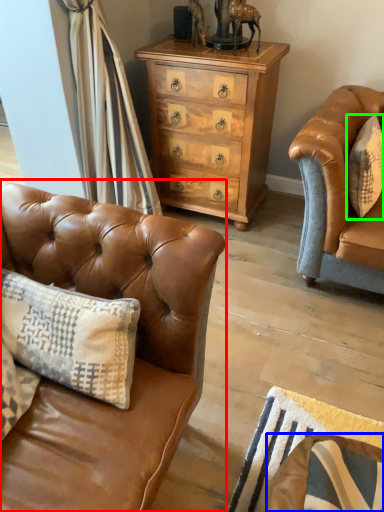
Question: Based on their relative distances, which object is farther from studio couch (highlighted by a red box)? Choose from swivel chair (highlighted by a blue box) and pillow (highlighted by a green box).

Choices:
 (A) swivel chair
 (B) pillow

Answer: (B)